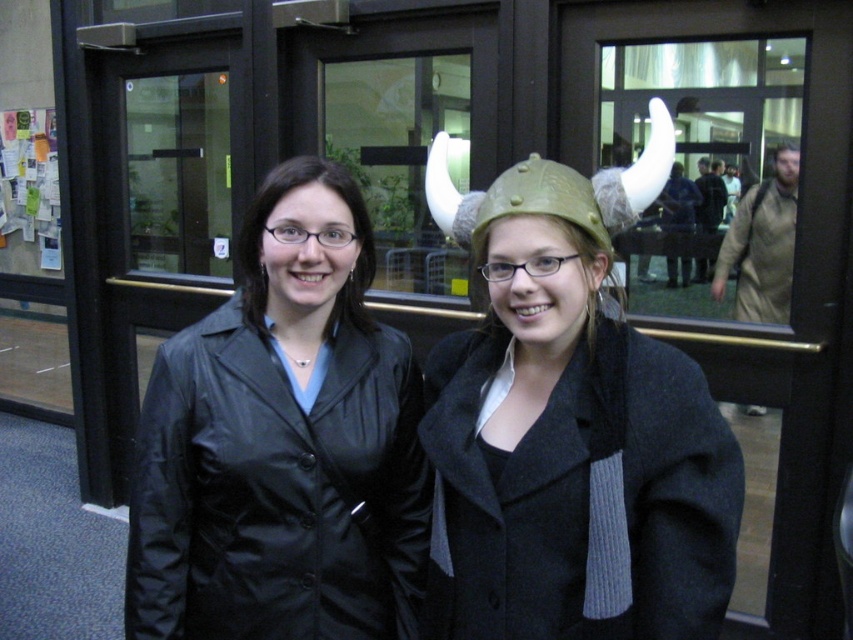
Question: Among these points, which one is nearest to the camera?

Choices:
 (A) (422, 564)
 (B) (433, 204)
 (C) (589, 214)
 (D) (695, 416)

Answer: (D)

Question: Can you confirm if black leather jacket at center is positioned to the left of gold metallic helmet at center?

Choices:
 (A) yes
 (B) no

Answer: (A)

Question: Is black leather jacket at center below matte olive green helmet at center?

Choices:
 (A) yes
 (B) no

Answer: (A)

Question: Which point is closer to the camera taking this photo?

Choices:
 (A) (506, 472)
 (B) (596, 216)
 (C) (647, 180)

Answer: (B)

Question: Which object appears farthest from the camera in this image?

Choices:
 (A) gold metallic helmet at center
 (B) black leather jacket at center
 (C) matte olive green helmet at center

Answer: (B)

Question: Observing the image, what is the correct spatial positioning of gold metallic helmet at center in reference to matte olive green helmet at center?

Choices:
 (A) right
 (B) left

Answer: (A)